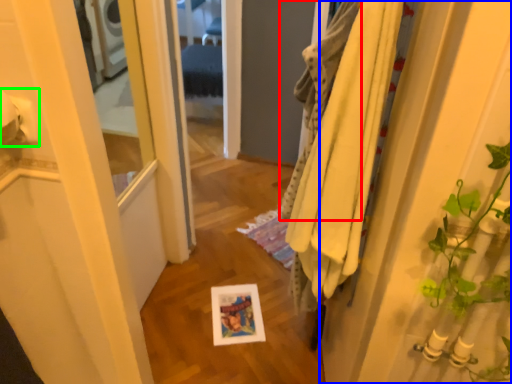
Question: Considering the real-world distances, which object is farthest from bath towel (highlighted by a red box)? door (highlighted by a blue box) or toilet paper (highlighted by a green box)?

Choices:
 (A) door
 (B) toilet paper

Answer: (B)